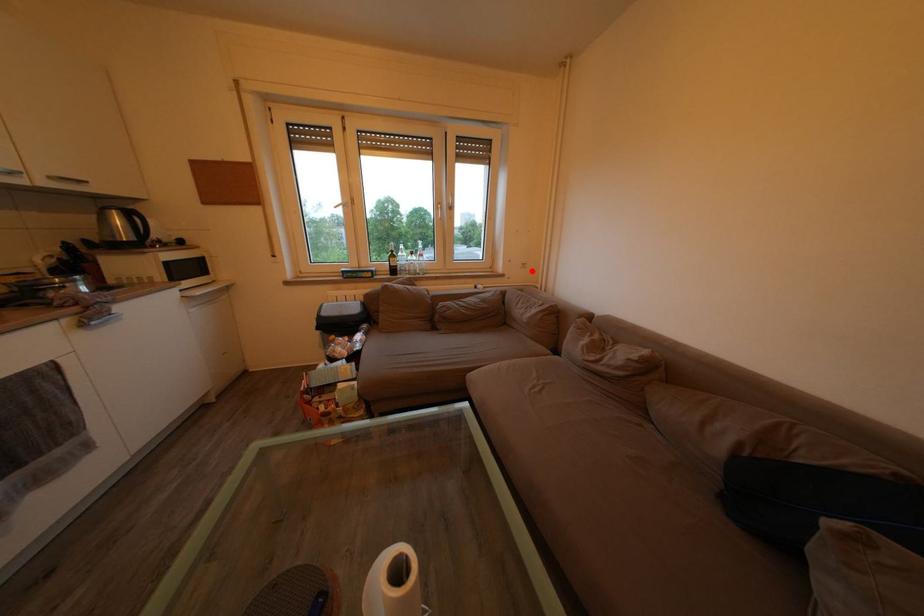
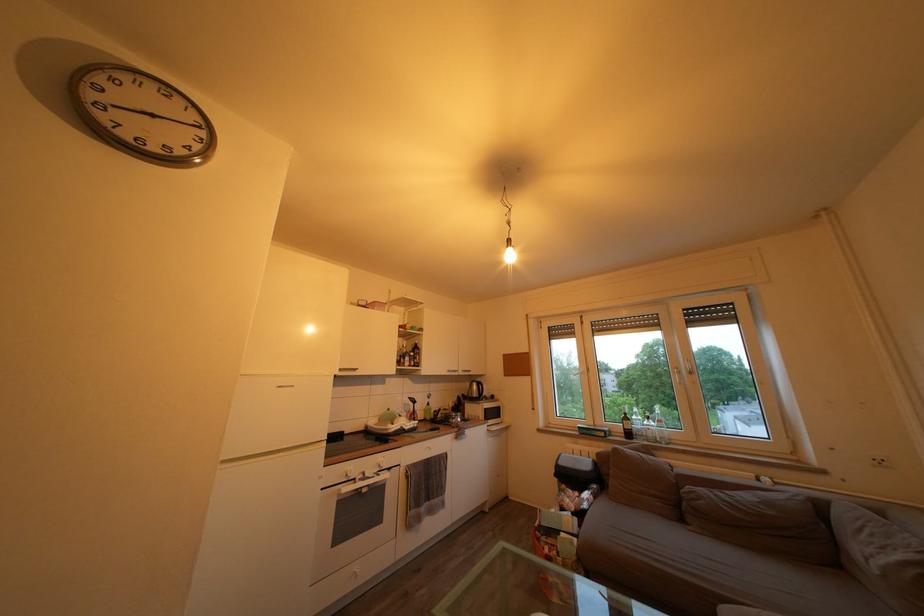
In the second image, find the point that corresponds to the highlighted location in the first image.

(889, 468)